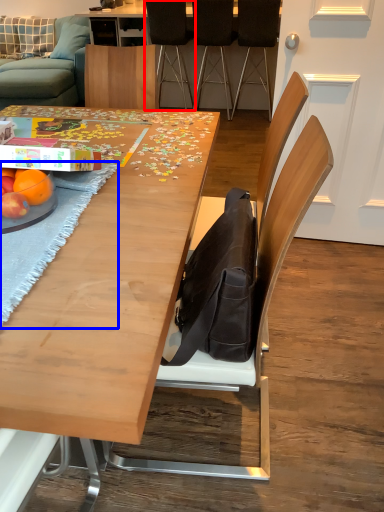
Question: Which object is closer to the camera taking this photo, chair (highlighted by a red box) or place mat (highlighted by a blue box)?

Choices:
 (A) chair
 (B) place mat

Answer: (B)